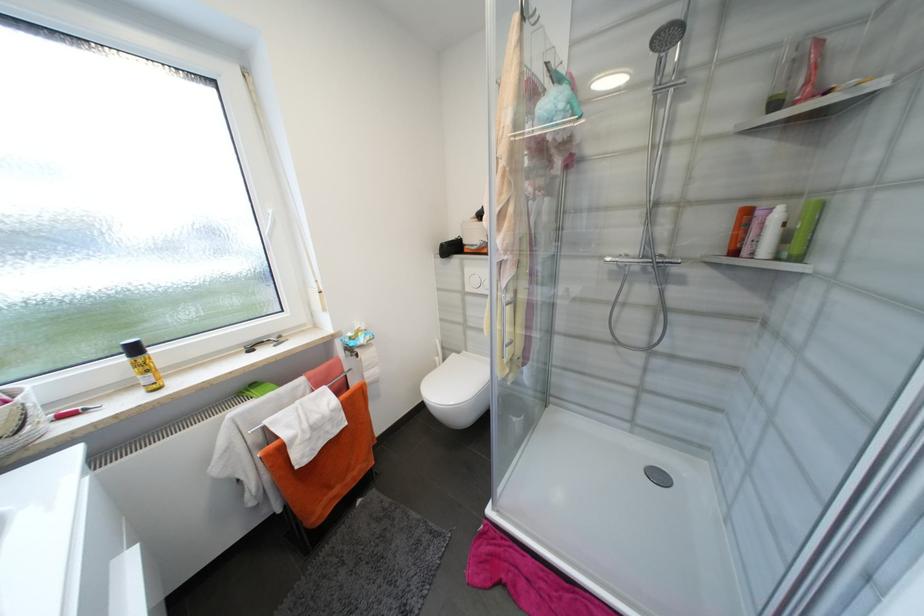
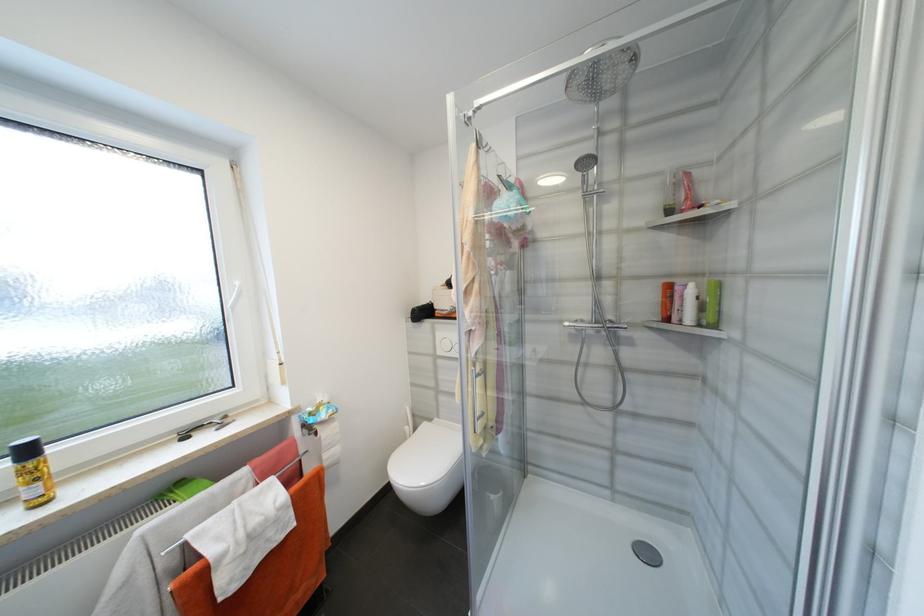
The point at (140, 351) is marked in the first image. Where is the corresponding point in the second image?

(33, 453)